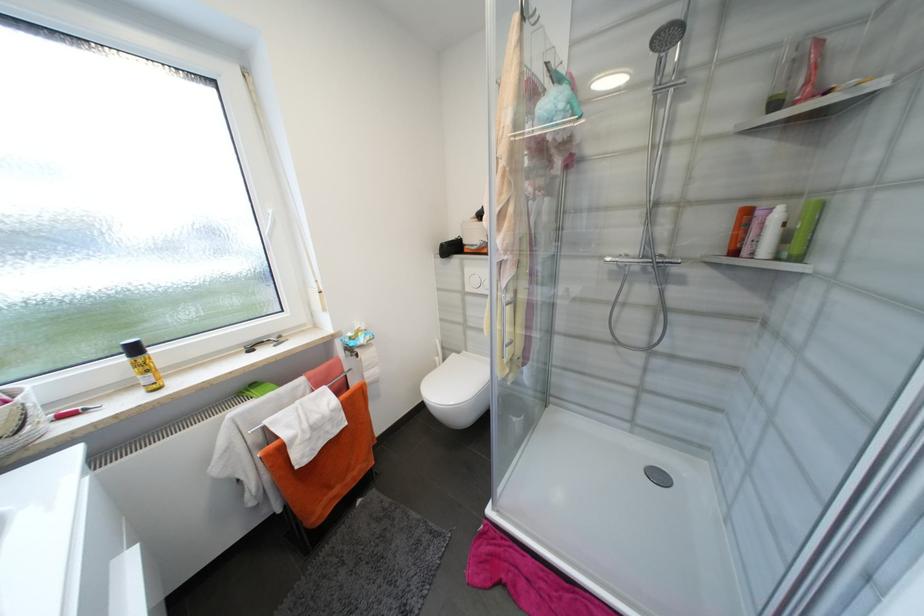
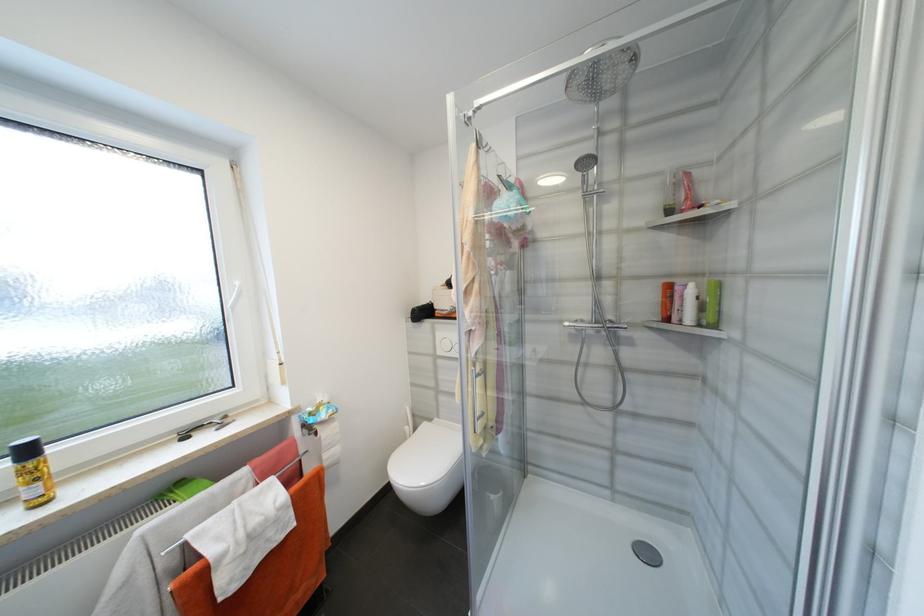
The point at (140, 351) is marked in the first image. Where is the corresponding point in the second image?

(33, 453)